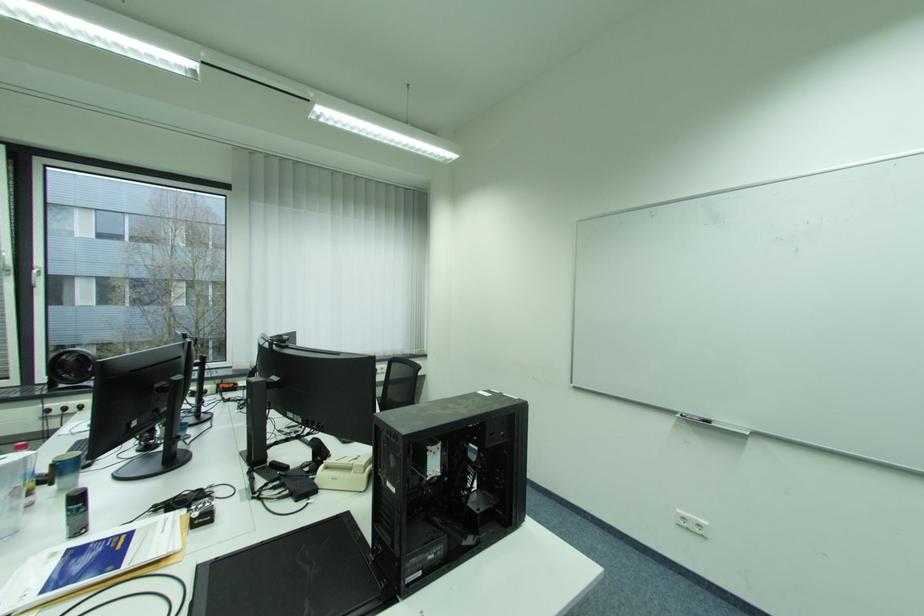
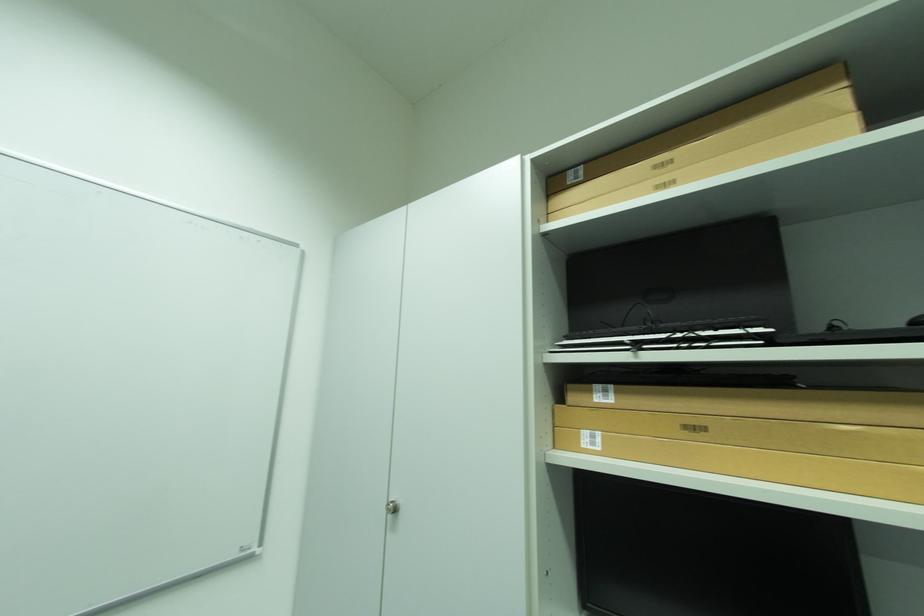
Question: The camera is either moving clockwise (left) or counter-clockwise (right) around the object. The first image is from the beginning of the video and the second image is from the end. Is the camera moving left or right when shooting the video?

Choices:
 (A) Left
 (B) Right

Answer: (A)